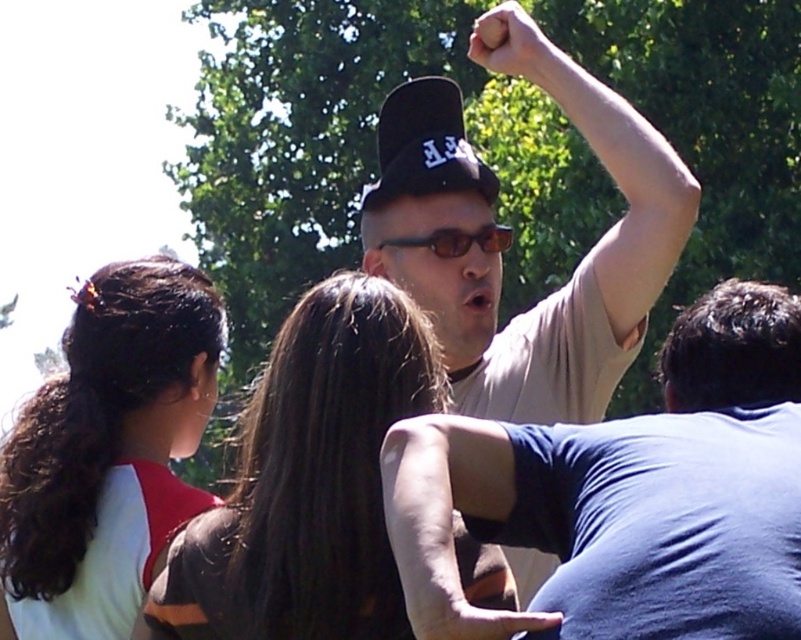
Question: Which of the following is the closest to the observer?

Choices:
 (A) dark brown hair at center
 (B) beige t-shirt at upper right
 (C) smooth skin arm at center

Answer: (C)

Question: Does smooth skin hand at upper center have a smaller size compared to sunglasses at center?

Choices:
 (A) yes
 (B) no

Answer: (B)

Question: Is smooth skin hand at upper center in front of sunglasses at center?

Choices:
 (A) no
 (B) yes

Answer: (B)

Question: Which of these objects is positioned closest to the sunglasses at center?

Choices:
 (A) matte beige shirt at upper center
 (B) dark brown hair at center
 (C) matte beige shirt at center

Answer: (C)

Question: Is black matte baseball cap at center below matte black fist at upper center?

Choices:
 (A) no
 (B) yes

Answer: (B)

Question: Estimate the real-world distances between objects in this image. Which object is closer to the black matte baseball cap at center?

Choices:
 (A) matte beige shirt at center
 (B) smooth skin hand at upper center
 (C) smooth skin arm at center
 (D) dark brown hair at center

Answer: (A)